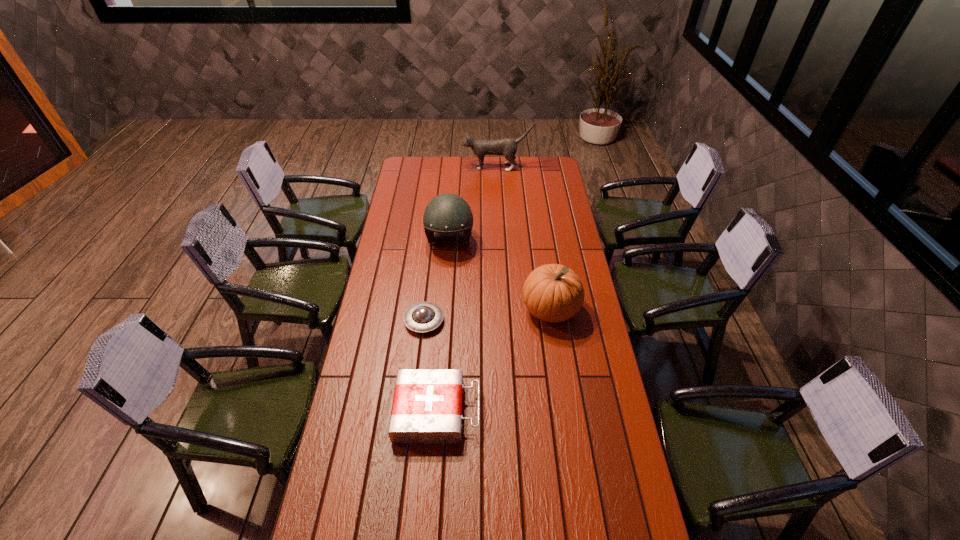
Identify the location of vacant space that is in between the pumpkin and the saucer. [488, 315].

Image resolution: width=960 pixels, height=540 pixels. I want to click on unoccupied area between the football helmet and the first-aid kit, so click(x=444, y=326).

Locate an element on the screen. This screenshot has width=960, height=540. vacant space that is in between the football helmet and the saucer is located at coordinates (437, 281).

In order to click on unoccupied area between the saucer and the football helmet in this screenshot , I will do `click(437, 281)`.

Locate an element on the screen. object that is the third closest to the pumpkin is located at coordinates (421, 317).

Locate an element on the screen. The image size is (960, 540). object that is the third closest to the football helmet is located at coordinates [508, 147].

At what (x,y) coordinates should I click in order to perform the action: click on free space in the image that satisfies the following two spatial constraints: 1. at the face of the cat; 2. at the face opening of the football helmet. Please return your answer as a coordinate pair (x, y). This screenshot has height=540, width=960. Looking at the image, I should click on (501, 241).